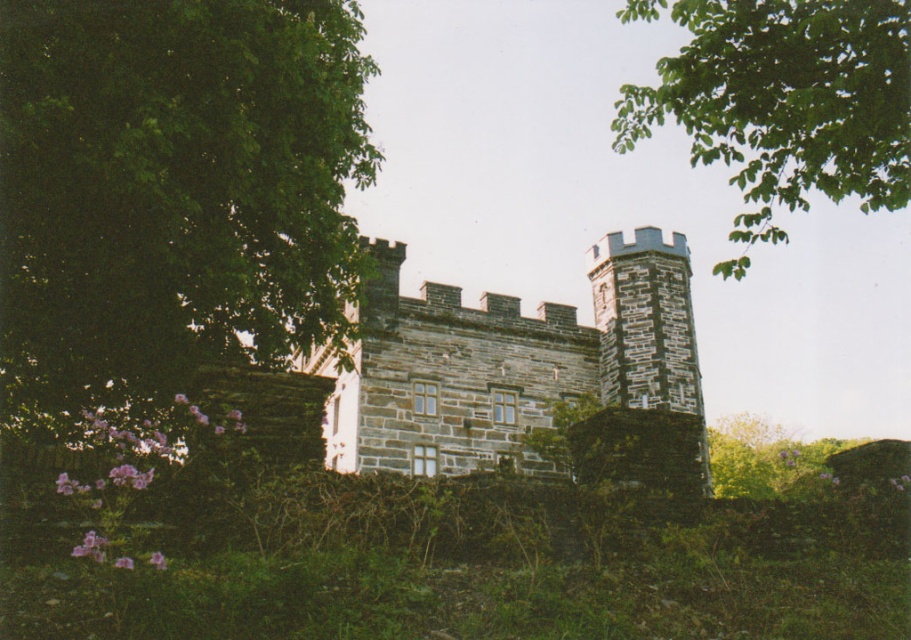
Does green leafy tree at left appear over gray stone castle at center?

Indeed, green leafy tree at left is positioned over gray stone castle at center.

How distant is green leafy tree at left from gray stone castle at center?

green leafy tree at left is 17.20 meters away from gray stone castle at center.

You are a GUI agent. You are given a task and a screenshot of the screen. Output one action in this format:
    pyautogui.click(x=<x>, y=<y>)
    Task: Click on the green leafy tree at left
    
    Given the screenshot: What is the action you would take?
    pyautogui.click(x=172, y=188)

Where is `green leafy tree at left`? This screenshot has width=911, height=640. green leafy tree at left is located at coordinates (172, 188).

Can you confirm if green leafy tree at left is wider than green leafy tree at upper right?

Incorrect, green leafy tree at left's width does not surpass green leafy tree at upper right's.

Between green leafy tree at left and green leafy tree at upper right, which one has less height?

Standing shorter between the two is green leafy tree at left.

Between point (132, 173) and point (908, 100), which one is positioned in front?

Positioned in front is point (908, 100).

Find the location of `green leafy tree at left`. green leafy tree at left is located at coordinates (172, 188).

Is gray stone castle at center to the right of green leafy tree at upper right from the viewer's perspective?

Incorrect, gray stone castle at center is not on the right side of green leafy tree at upper right.

Between point (366, 420) and point (725, 264), which one is positioned in front?

Point (725, 264) is more forward.

Who is more forward, (x=590, y=394) or (x=847, y=8)?

Point (x=847, y=8)

Find the location of a particular element. This screenshot has height=640, width=911. gray stone castle at center is located at coordinates (507, 362).